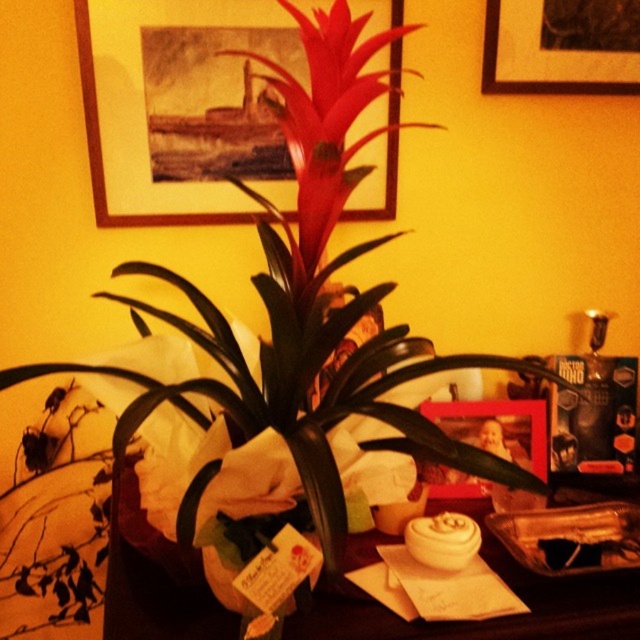
You are arranging flowers in the green matte vase at center. You want to ensure the flowers are visible from the front of the wooden picture frame at upper center. Is the vase positioned in a way that allows this?

The green matte vase at center is behind the wooden picture frame at upper center, so the flowers in the vase would not be visible from the front of the wooden picture frame at upper center.

You are standing in the room and see the point at coordinate (561, 45). What object is located at that point?

The point at coordinate (561, 45) corresponds to the wooden picture frame at upper center.

You are a delivery person who needs to place a rectangular box that is 30 inches long on the matte black table at center. However, there is a wooden picture frame at upper center nearby. Can the box be placed on the table without touching the frame?

The matte black table at center and wooden picture frame at upper center are 31.48 inches apart. Since the box is 30 inches long, it can be placed on the matte black table at center without touching the wooden picture frame at upper center as there is enough space between them.